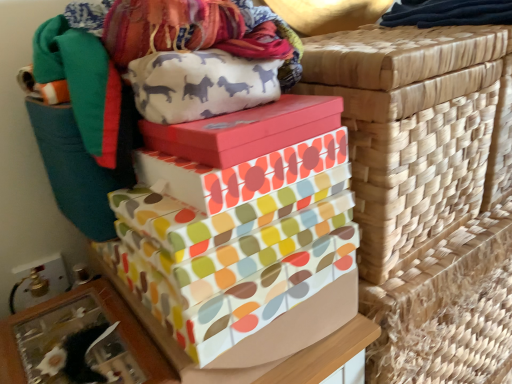
In order to click on free spot above matte pink box at center, placed as the first gift box when sorted from top to bottom (from a real-world perspective) in this screenshot , I will do `click(260, 112)`.